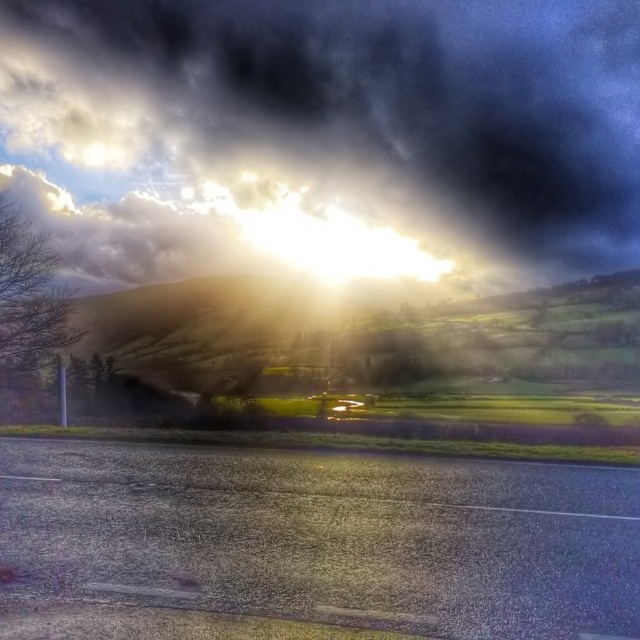
Can you confirm if dark gray cloud at upper center is shorter than bare branches at left?

In fact, dark gray cloud at upper center may be taller than bare branches at left.

Can you confirm if dark gray cloud at upper center is bigger than bare branches at left?

Yes, dark gray cloud at upper center is bigger than bare branches at left.

Image resolution: width=640 pixels, height=640 pixels. Identify the location of dark gray cloud at upper center. (326, 138).